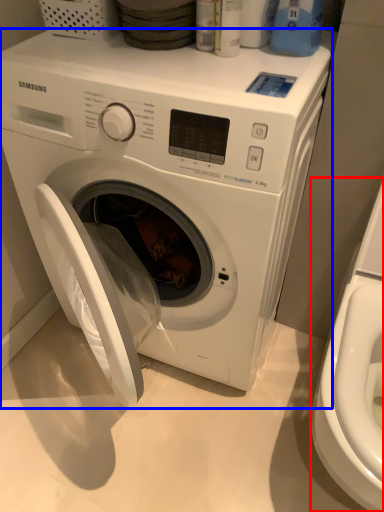
Question: Which point is further to the camera, washer (highlighted by a red box) or washing machine (highlighted by a blue box)?

Choices:
 (A) washer
 (B) washing machine

Answer: (B)